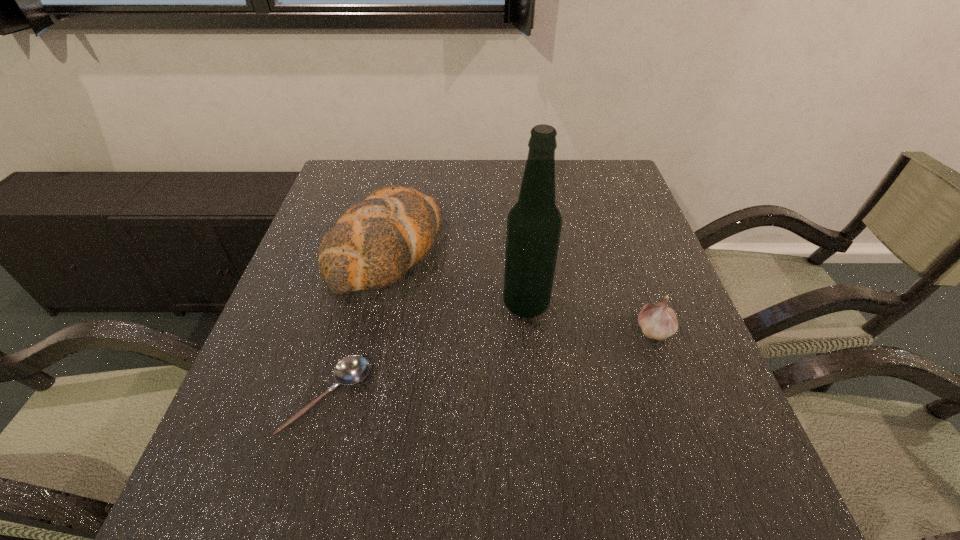
Image resolution: width=960 pixels, height=540 pixels. Find the location of `free space between the rightmost object and the nearest object`. free space between the rightmost object and the nearest object is located at coordinates (491, 363).

Where is `vacant area between the second object from right to left and the garlic`? This screenshot has height=540, width=960. vacant area between the second object from right to left and the garlic is located at coordinates (589, 316).

Image resolution: width=960 pixels, height=540 pixels. Find the location of `free spot between the tallest object and the rightmost object`. free spot between the tallest object and the rightmost object is located at coordinates (589, 316).

Where is `empty location between the garlic and the ladle`? The width and height of the screenshot is (960, 540). empty location between the garlic and the ladle is located at coordinates (491, 363).

This screenshot has width=960, height=540. Identify the location of vacant area that lies between the garlic and the ladle. (491, 363).

I want to click on free area in between the garlic and the nearest object, so click(491, 363).

This screenshot has height=540, width=960. In order to click on vacant area between the tallest object and the nearest object in this screenshot , I will do `click(426, 350)`.

Identify the location of vacant space in between the ladle and the rightmost object. The image size is (960, 540). (491, 363).

What are the coordinates of `object that stands as the third closest to the tallest object` in the screenshot? It's located at (350, 370).

Where is `object that is the closest to the bread`? object that is the closest to the bread is located at coordinates (534, 223).